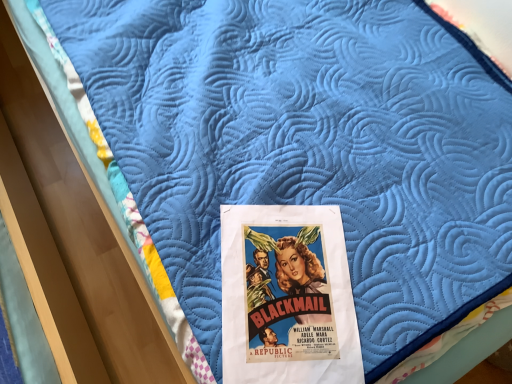
Where is `vintage paper poster at center`? This screenshot has width=512, height=384. vintage paper poster at center is located at coordinates coord(287,296).

This screenshot has height=384, width=512. What do you see at coordinates (287, 296) in the screenshot?
I see `vintage paper poster at center` at bounding box center [287, 296].

Measure the distance between point (329, 247) and camera.

Point (329, 247) and camera are 71.00 centimeters apart.

Identify the location of vintage paper poster at center. (287, 296).